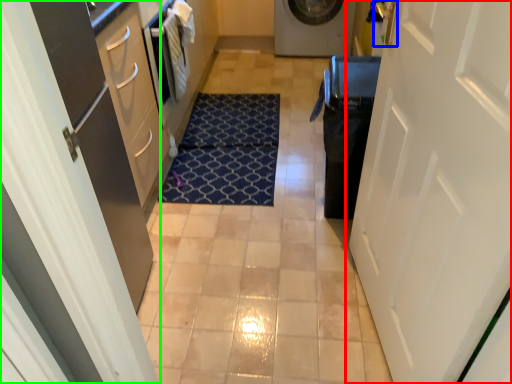
Question: Which object is the closest to the door (highlighted by a red box)? Choose among these: door handle (highlighted by a blue box) or door (highlighted by a green box).

Choices:
 (A) door handle
 (B) door

Answer: (A)